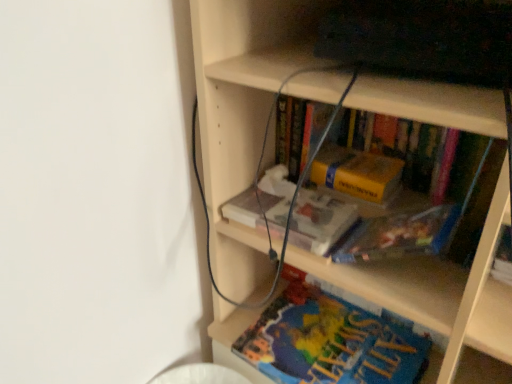
Question: In terms of height, does blue matte book at lower center, positioned as the 2th book in top-to-bottom order, look taller or shorter compared to wooden bookcase at center?

Choices:
 (A) tall
 (B) short

Answer: (B)

Question: Considering the positions of blue matte book at lower center, which is counted as the 1th book, starting from the bottom, and wooden bookcase at center in the image, is blue matte book at lower center, which is counted as the 1th book, starting from the bottom, bigger or smaller than wooden bookcase at center?

Choices:
 (A) small
 (B) big

Answer: (A)

Question: Estimate the real-world distances between objects in this image. Which object is farther from the yellow matte book at center, positioned as the 1th book in top-to-bottom order?

Choices:
 (A) yellow matte paperback book at center
 (B) wooden bookcase at center
 (C) blue matte book at lower center, which is counted as the 1th book, starting from the bottom

Answer: (C)

Question: Which object is the closest to the blue matte book at lower center, positioned as the 2th book in top-to-bottom order?

Choices:
 (A) wooden bookcase at center
 (B) yellow matte paperback book at center
 (C) yellow matte book at center, positioned as the 1th book in top-to-bottom order

Answer: (A)